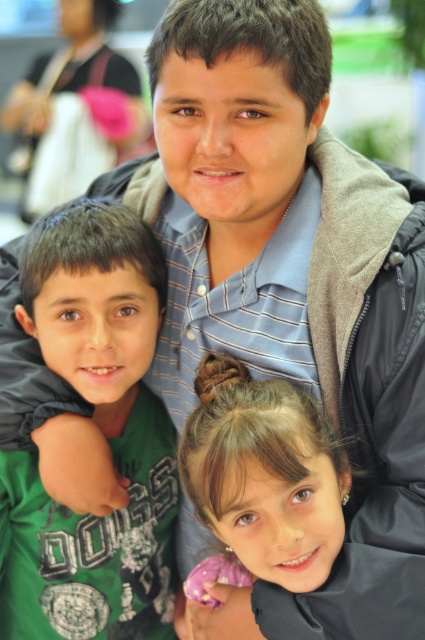
Question: Which point is closer to the camera?

Choices:
 (A) green cotton shirt at center
 (B) smooth brown hair at lower center

Answer: (B)

Question: Can you confirm if green cotton shirt at center is thinner than smooth brown hair at lower center?

Choices:
 (A) yes
 (B) no

Answer: (A)

Question: Which of the following is the closest to the observer?

Choices:
 (A) (104, 577)
 (B) (314, 422)

Answer: (B)

Question: Observing the image, what is the correct spatial positioning of green cotton shirt at center in reference to smooth brown hair at lower center?

Choices:
 (A) above
 (B) below

Answer: (A)

Question: Considering the relative positions of green cotton shirt at center and smooth brown hair at lower center in the image provided, where is green cotton shirt at center located with respect to smooth brown hair at lower center?

Choices:
 (A) right
 (B) left

Answer: (B)